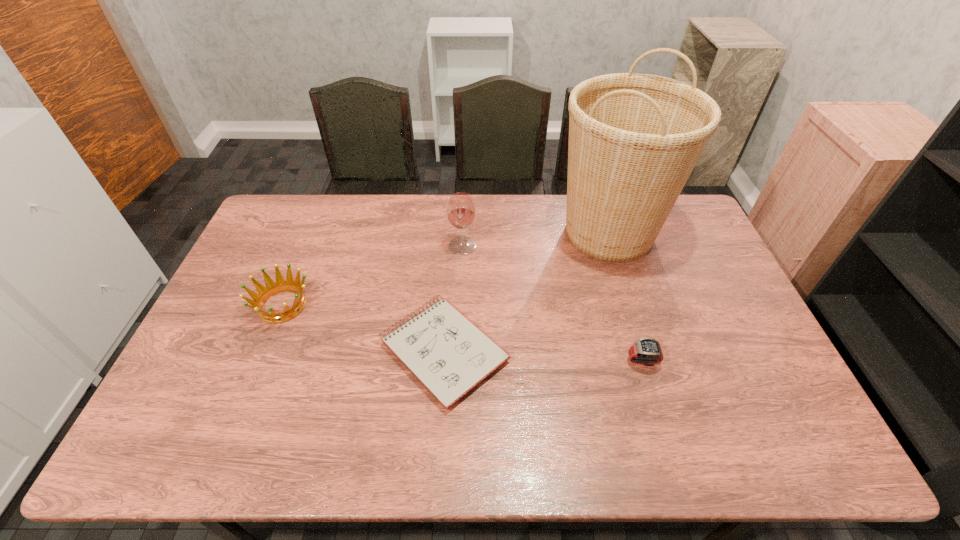
You are a GUI agent. You are given a task and a screenshot of the screen. Output one action in this format:
    pyautogui.click(x=<x>, y=<y>)
    Task: Click on the tallest object
    Image resolution: width=960 pixels, height=540 pixels.
    Given the screenshot: What is the action you would take?
    pyautogui.click(x=634, y=139)

Image resolution: width=960 pixels, height=540 pixels. I want to click on wineglass, so pyautogui.click(x=461, y=211).

Find the location of a particular element. the leftmost object is located at coordinates (264, 293).

Find the location of a particular element. The width and height of the screenshot is (960, 540). the third tallest object is located at coordinates (264, 293).

Where is `the second shortest object`? the second shortest object is located at coordinates click(646, 351).

What are the coordinates of `the shortest object` in the screenshot? It's located at (449, 355).

At what (x,y) coordinates should I click in order to perform the action: click on vacant space positioned 0.270m on the front of the tallest object. Please return your answer as a coordinate pair (x, y). Looking at the image, I should click on (643, 342).

I want to click on vacant space located 0.180m on the right of the second tallest object, so click(529, 245).

You are a GUI agent. You are given a task and a screenshot of the screen. Output one action in this format:
    pyautogui.click(x=<x>, y=<y>)
    Task: Click on the free spot located 0.210m on the right of the third shortest object
    This screenshot has height=540, width=960.
    Given the screenshot: What is the action you would take?
    pyautogui.click(x=382, y=306)

The height and width of the screenshot is (540, 960). Find the location of `free space located 0.060m on the back of the second shortest object`. free space located 0.060m on the back of the second shortest object is located at coordinates (635, 333).